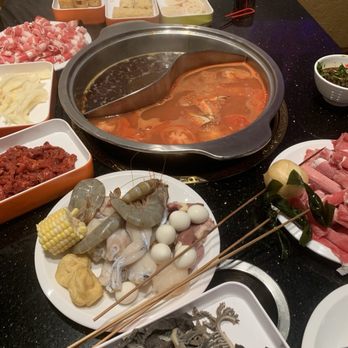
The image size is (348, 348). I want to click on table, so click(x=291, y=47).